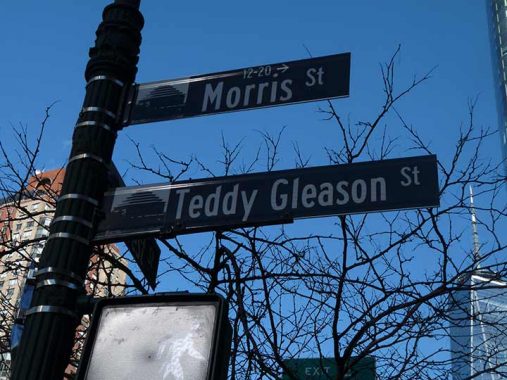
You are a GUI agent. You are given a task and a screenshot of the screen. Output one action in this format:
    pyautogui.click(x=<x>, y=<y>)
    Task: Click on the exit sign
    This screenshot has height=380, width=507.
    Given the screenshot: What is the action you would take?
    pyautogui.click(x=313, y=364)